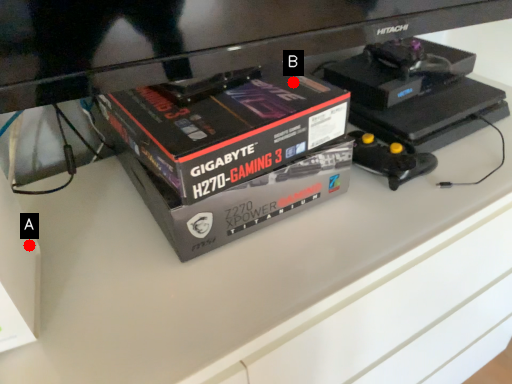
Question: Two points are circled on the image, labeled by A and B beside each circle. Which of the following is the farthest from the observer?

Choices:
 (A) A is further
 (B) B is further

Answer: (B)